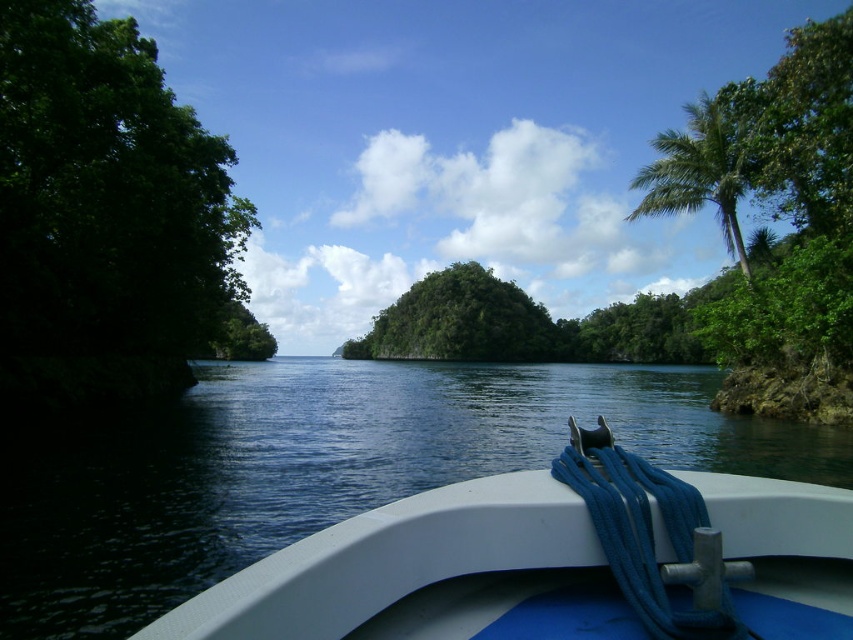
Question: Does white plastic boat at lower center have a greater width compared to green leafy palm tree at upper right?

Choices:
 (A) yes
 (B) no

Answer: (B)

Question: Is white plastic boat at lower center to the right of green leafy palm tree at upper right from the viewer's perspective?

Choices:
 (A) no
 (B) yes

Answer: (A)

Question: Which of the following is the farthest from the observer?

Choices:
 (A) white plastic boat at lower center
 (B) green leafy island at center

Answer: (B)

Question: In this image, where is green leafy tree at left located relative to green leafy palm tree at upper right?

Choices:
 (A) left
 (B) right

Answer: (A)

Question: Estimate the real-world distances between objects in this image. Which object is farther from the green leafy tree at left?

Choices:
 (A) green leafy island at center
 (B) green leafy palm tree at upper right

Answer: (A)

Question: Which object appears farthest from the camera in this image?

Choices:
 (A) green leafy palm tree at upper right
 (B) green leafy island at center

Answer: (B)